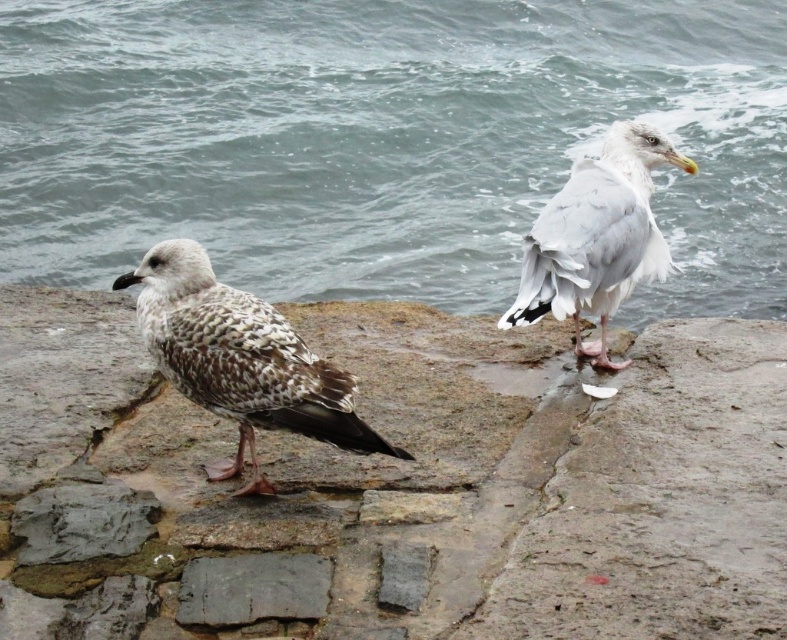
Who is higher up, white feathered bird at upper right or smooth gray stone at center?

Positioned higher is white feathered bird at upper right.

Based on the photo, who is lower down, white feathered bird at upper right or smooth gray stone at center?

smooth gray stone at center

Is point (514, 324) in front of point (233, 576)?

That is False.

This screenshot has height=640, width=787. Find the location of `white feathered bird at upper right`. white feathered bird at upper right is located at coordinates (597, 237).

Is rough stone at center to the left of white feathered bird at upper right from the viewer's perspective?

Yes, rough stone at center is to the left of white feathered bird at upper right.

Is point (297, 525) farther from camera compared to point (575, 218)?

No.

Does point (392, 492) come closer to viewer compared to point (612, 125)?

That is True.

I want to click on rough stone at center, so click(x=403, y=481).

Can you confirm if gray water at center is positioned above speckled feathered seagull at left?

Correct, gray water at center is located above speckled feathered seagull at left.

Looking at this image, can you confirm if gray water at center is thinner than speckled feathered seagull at left?

No, gray water at center is not thinner than speckled feathered seagull at left.

Is point (390, 67) positioned in front of point (212, 406)?

No, it is not.

Where is `gray water at center`? This screenshot has height=640, width=787. gray water at center is located at coordinates (383, 141).